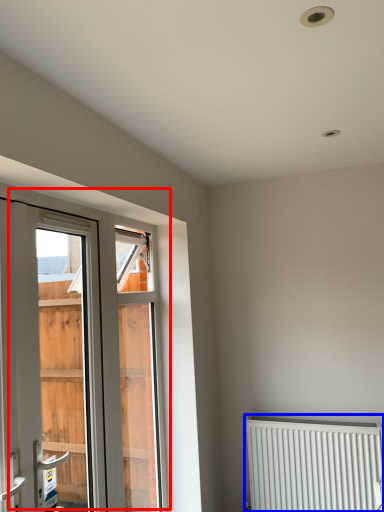
Question: Which object appears farthest to the camera in this image, window (highlighted by a red box) or radiator (highlighted by a blue box)?

Choices:
 (A) window
 (B) radiator

Answer: (B)